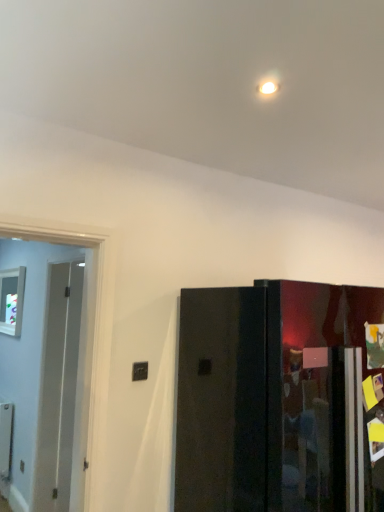
Question: Can you confirm if transparent glass window at left is positioned to the left of white glossy door at left, the first door in the left-to-right sequence?

Choices:
 (A) no
 (B) yes

Answer: (B)

Question: Is white glossy door at left, the second door in the right-to-left sequence, surrounded by transparent glass window at left?

Choices:
 (A) yes
 (B) no

Answer: (B)

Question: Is transparent glass window at left not near white glossy door at left, the second door in the right-to-left sequence?

Choices:
 (A) yes
 (B) no

Answer: (B)

Question: Does transparent glass window at left have a greater height compared to white glossy door at left, the first door in the left-to-right sequence?

Choices:
 (A) no
 (B) yes

Answer: (A)

Question: From the image's perspective, does transparent glass window at left appear higher than white glossy door at left, the first door in the left-to-right sequence?

Choices:
 (A) yes
 (B) no

Answer: (A)

Question: From the image's perspective, does transparent glass window at left appear lower than white glossy door at left, the first door in the left-to-right sequence?

Choices:
 (A) yes
 (B) no

Answer: (B)

Question: Is glossy black refrigerator at right, the 2th door in the left-to-right sequence, aimed at white glossy door at left, the second door in the right-to-left sequence?

Choices:
 (A) yes
 (B) no

Answer: (B)

Question: Considering the relative sizes of glossy black refrigerator at right, the 2th door in the left-to-right sequence, and white glossy door at left, the second door in the right-to-left sequence, in the image provided, is glossy black refrigerator at right, the 2th door in the left-to-right sequence, bigger than white glossy door at left, the second door in the right-to-left sequence,?

Choices:
 (A) yes
 (B) no

Answer: (A)

Question: Considering the relative sizes of glossy black refrigerator at right, which is the 1th door from right to left, and white glossy door at left, the first door in the left-to-right sequence, in the image provided, is glossy black refrigerator at right, which is the 1th door from right to left, wider than white glossy door at left, the first door in the left-to-right sequence,?

Choices:
 (A) yes
 (B) no

Answer: (A)

Question: Is the surface of glossy black refrigerator at right, the 2th door in the left-to-right sequence, in direct contact with white glossy door at left, the first door in the left-to-right sequence?

Choices:
 (A) yes
 (B) no

Answer: (B)

Question: Is white glossy door at left, the first door in the left-to-right sequence, completely or partially inside glossy black refrigerator at right, the 2th door in the left-to-right sequence?

Choices:
 (A) no
 (B) yes

Answer: (A)

Question: From the image's perspective, is glossy black refrigerator at right, the 2th door in the left-to-right sequence, located beneath white glossy door at left, the first door in the left-to-right sequence?

Choices:
 (A) yes
 (B) no

Answer: (A)

Question: Is white glossy door at left, the first door in the left-to-right sequence, wider than transparent glass window at left?

Choices:
 (A) yes
 (B) no

Answer: (A)